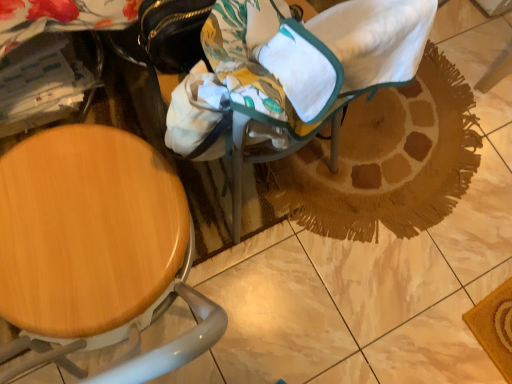
Question: Can you confirm if wooden seat at left is shorter than brown woven mat at center?

Choices:
 (A) yes
 (B) no

Answer: (B)

Question: Is brown woven mat at center inside wooden seat at left?

Choices:
 (A) no
 (B) yes

Answer: (A)

Question: Is wooden seat at left turned away from brown woven mat at center?

Choices:
 (A) yes
 (B) no

Answer: (B)

Question: Is wooden seat at left beside brown woven mat at center?

Choices:
 (A) no
 (B) yes

Answer: (A)

Question: Does wooden seat at left have a lesser width compared to brown woven mat at center?

Choices:
 (A) yes
 (B) no

Answer: (A)

Question: In the image, is brown woven mat at center on the left side or the right side of canvas fabric baby carriage at center?

Choices:
 (A) left
 (B) right

Answer: (B)

Question: Is brown woven mat at center taller or shorter than canvas fabric baby carriage at center?

Choices:
 (A) short
 (B) tall

Answer: (A)

Question: From a real-world perspective, is brown woven mat at center above or below canvas fabric baby carriage at center?

Choices:
 (A) above
 (B) below

Answer: (B)

Question: From the image's perspective, is brown woven mat at center located above or below canvas fabric baby carriage at center?

Choices:
 (A) below
 (B) above

Answer: (A)

Question: Is brown woven mat at center inside the boundaries of wooden seat at left, or outside?

Choices:
 (A) inside
 (B) outside

Answer: (B)

Question: From their relative heights in the image, would you say brown woven mat at center is taller or shorter than wooden seat at left?

Choices:
 (A) tall
 (B) short

Answer: (B)

Question: Considering the relative positions of brown woven mat at center and wooden seat at left in the image provided, is brown woven mat at center to the left or to the right of wooden seat at left?

Choices:
 (A) left
 (B) right

Answer: (B)

Question: Is brown woven mat at center wider or thinner than wooden seat at left?

Choices:
 (A) wide
 (B) thin

Answer: (A)

Question: From a real-world perspective, is wooden seat at left above or below canvas fabric baby carriage at center?

Choices:
 (A) above
 (B) below

Answer: (B)

Question: Would you say wooden seat at left is to the left or to the right of canvas fabric baby carriage at center in the picture?

Choices:
 (A) left
 (B) right

Answer: (A)